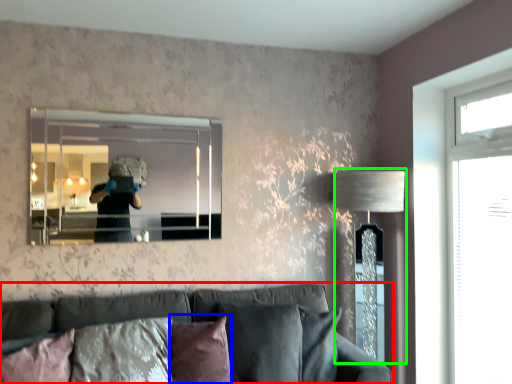
Question: Which is nearer to the studio couch (highlighted by a red box)? pillow (highlighted by a blue box) or table lamp (highlighted by a green box).

Choices:
 (A) pillow
 (B) table lamp

Answer: (A)